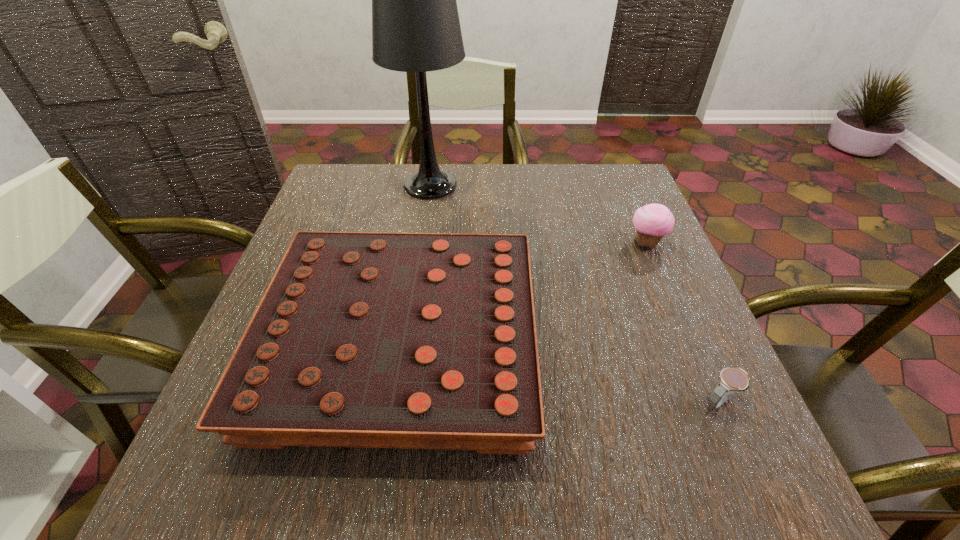
The width and height of the screenshot is (960, 540). Identify the location of table lamp. (415, 23).

Identify the location of the tallest object. (415, 23).

This screenshot has height=540, width=960. What are the coordinates of `cupcake` in the screenshot? It's located at (653, 221).

Where is `gameboard`? The width and height of the screenshot is (960, 540). gameboard is located at coordinates (362, 339).

The height and width of the screenshot is (540, 960). What are the coordinates of `the shortest object` in the screenshot? It's located at (731, 379).

You are a GUI agent. You are given a task and a screenshot of the screen. Output one action in this format:
    pyautogui.click(x=<x>, y=<y>)
    Task: Click on the free space located on the front of the tallest object
    
    Given the screenshot: What is the action you would take?
    pyautogui.click(x=416, y=283)

Where is `vacant space located on the front of the second farthest object`? Image resolution: width=960 pixels, height=540 pixels. vacant space located on the front of the second farthest object is located at coordinates (708, 390).

What are the coordinates of `free space located on the back of the gameboard` in the screenshot? It's located at (426, 184).

Locate an element on the screen. This screenshot has width=960, height=540. free space located on the left of the watch is located at coordinates (499, 402).

The width and height of the screenshot is (960, 540). Find the location of `object present at the far edge`. object present at the far edge is located at coordinates (415, 23).